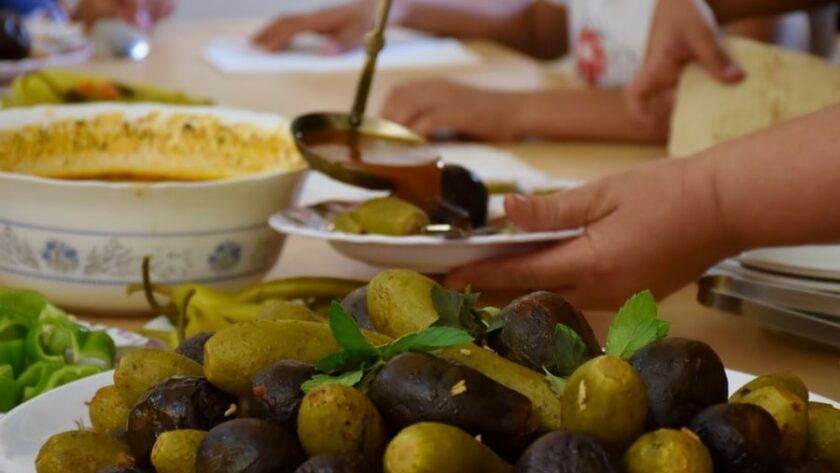
Find the location of `light brown wooden table`. light brown wooden table is located at coordinates (769, 342).